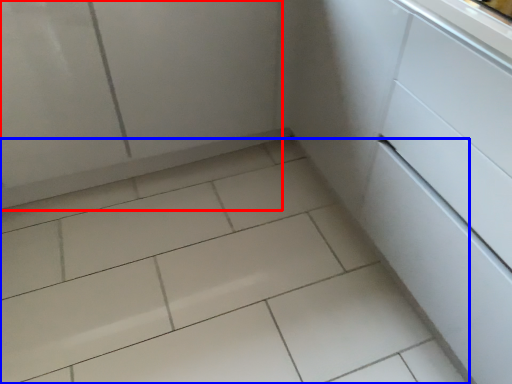
Question: Which object appears closest to the camera in this image, screen door (highlighted by a red box) or ceramic tile (highlighted by a blue box)?

Choices:
 (A) screen door
 (B) ceramic tile

Answer: (B)